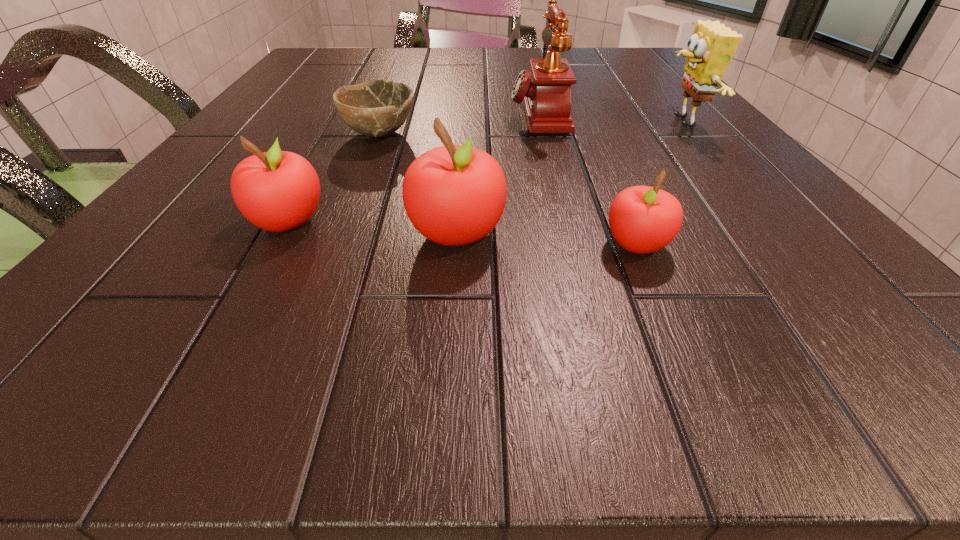
Please point a spot to add another apple on the right. Please provide its 2D coordinates. Your answer should be formatted as a tuple, i.e. [(x, y)], where the tuple contains the x and y coordinates of a point satisfying the conditions above.

[(829, 258)]